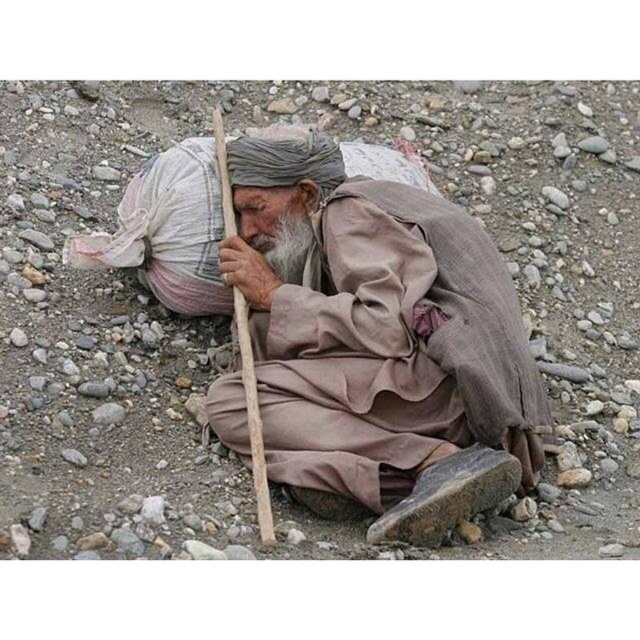
Where is `brown fabric at center`? This screenshot has width=640, height=640. brown fabric at center is located at coordinates (376, 330).

Is brown fabric at center smaller than gray/bearded at center?

No.

Does point (332, 173) come behind point (292, 266)?

Yes, it is behind point (292, 266).

Locate an element on the screen. This screenshot has width=640, height=640. brown fabric at center is located at coordinates (376, 330).